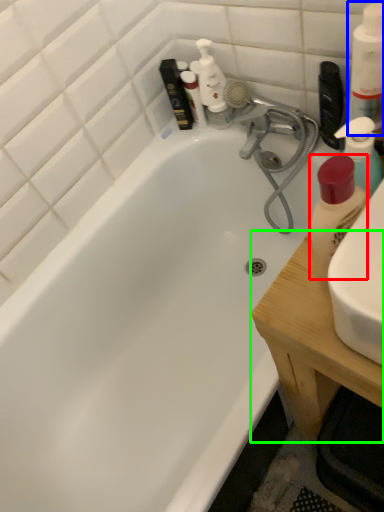
Question: Which is farther away from cleaning product (highlighted by a red box)? cleaning product (highlighted by a blue box) or counter top (highlighted by a green box)?

Choices:
 (A) cleaning product
 (B) counter top

Answer: (B)